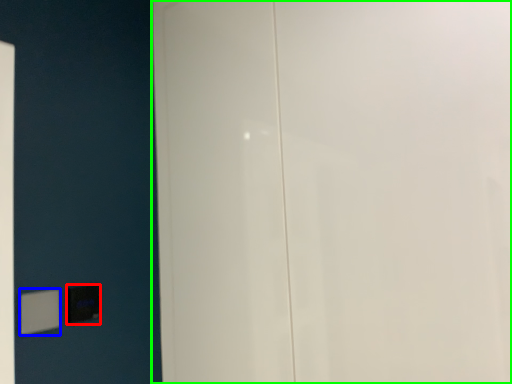
Question: Based on their relative distances, which object is nearer to light switch (highlighted by a red box)? Choose from light switch (highlighted by a blue box) and door (highlighted by a green box).

Choices:
 (A) light switch
 (B) door

Answer: (A)